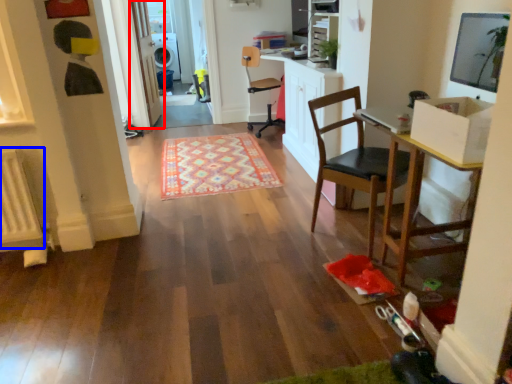
Question: Which object is further to the camera taking this photo, door (highlighted by a red box) or radiator (highlighted by a blue box)?

Choices:
 (A) door
 (B) radiator

Answer: (A)